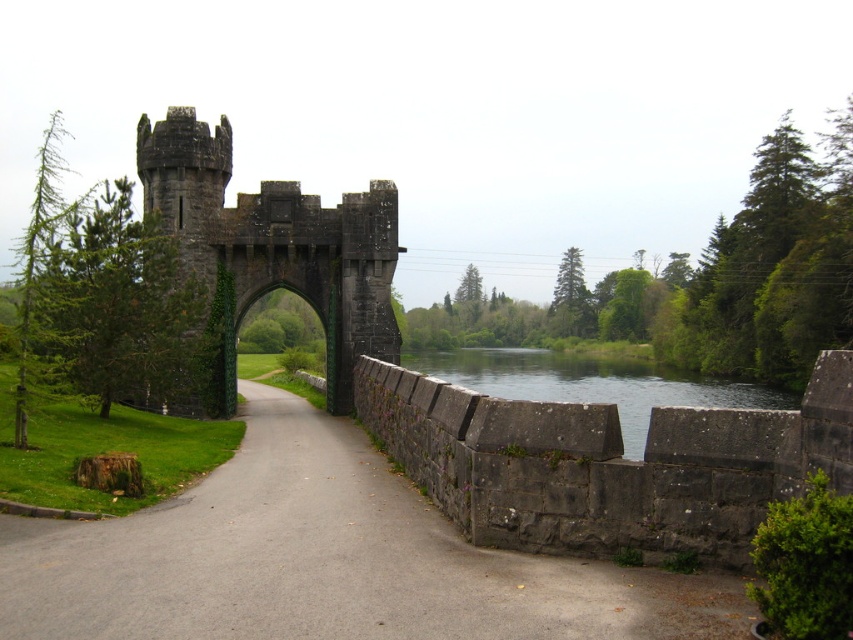
Does gray asphalt path at center have a greater width compared to clear water at bridge right?

In fact, gray asphalt path at center might be narrower than clear water at bridge right.

Is gray asphalt path at center smaller than clear water at bridge right?

Correct, gray asphalt path at center occupies less space than clear water at bridge right.

Who is more forward, (x=308, y=605) or (x=524, y=364)?

Positioned in front is point (x=308, y=605).

What are the coordinates of `gray asphalt path at center` in the screenshot? It's located at (325, 561).

Is point (184, 148) less distant than point (642, 396)?

Yes, it is.

Which is behind, point (344, 237) or point (566, 356)?

The point (566, 356) is more distant.

Image resolution: width=853 pixels, height=640 pixels. Find the location of `dark gray stone castle at center`. dark gray stone castle at center is located at coordinates (276, 244).

Is gray asphalt path at center smaller than dark gray stone castle at center?

Yes.

Can you confirm if gray asphalt path at center is thinner than dark gray stone castle at center?

Incorrect, gray asphalt path at center's width is not less than dark gray stone castle at center's.

Between point (204, 621) and point (315, 301), which one is positioned in front?

Point (204, 621)

You are a GUI agent. You are given a task and a screenshot of the screen. Output one action in this format:
    pyautogui.click(x=<x>, y=<y>)
    Task: Click on the gray asphalt path at center
    This screenshot has height=640, width=853.
    Given the screenshot: What is the action you would take?
    pyautogui.click(x=325, y=561)